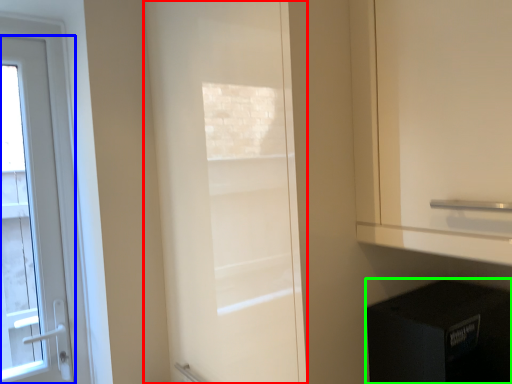
Question: Which object is positioned closest to door (highlighted by a red box)? Select from door (highlighted by a blue box) and appliance (highlighted by a green box).

Choices:
 (A) door
 (B) appliance

Answer: (B)